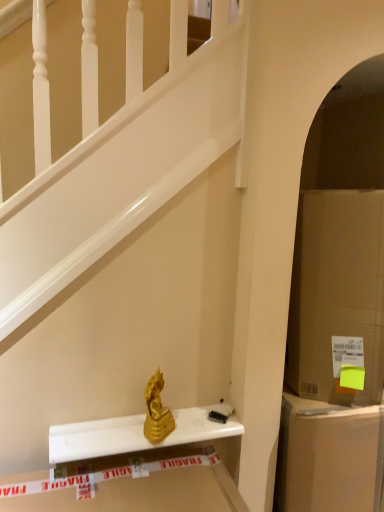
Question: From a real-world perspective, relative to cardboard box at right, is cardboard box at right vertically above or below?

Choices:
 (A) above
 (B) below

Answer: (B)

Question: Do you think cardboard box at right is within cardboard box at right, or outside of it?

Choices:
 (A) outside
 (B) inside

Answer: (A)

Question: Based on their relative distances, which object is farther from the gold metallic statue at center?

Choices:
 (A) gold metallic statue at center
 (B) cardboard box at right
 (C) cardboard box at right

Answer: (B)

Question: Which object is the closest to the cardboard box at right?

Choices:
 (A) cardboard box at right
 (B) gold metallic statue at center
 (C) gold metallic statue at center

Answer: (A)